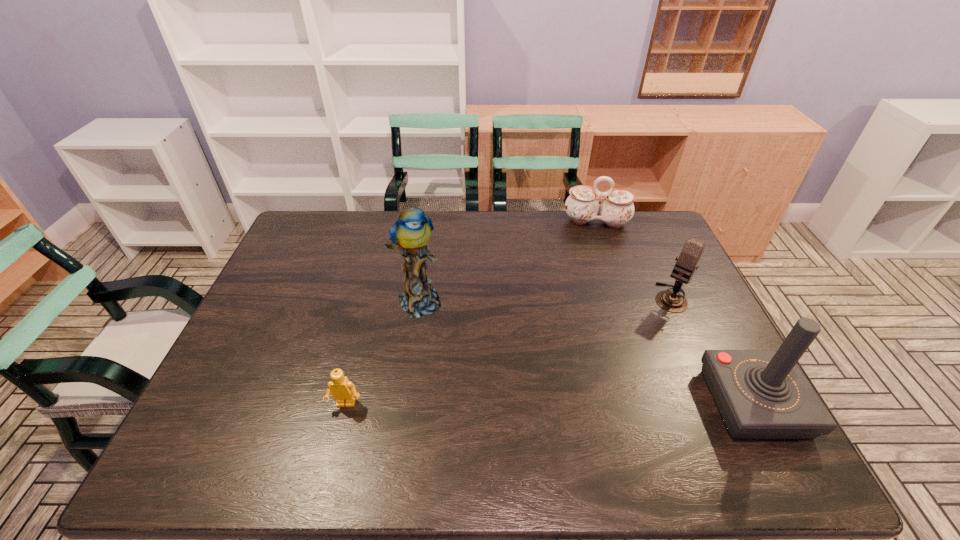
Find the location of a particular element. This screenshot has width=960, height=540. free space that satisfies the following two spatial constraints: 1. on the back side of the farthest object; 2. on the left side of the tallest object is located at coordinates (430, 222).